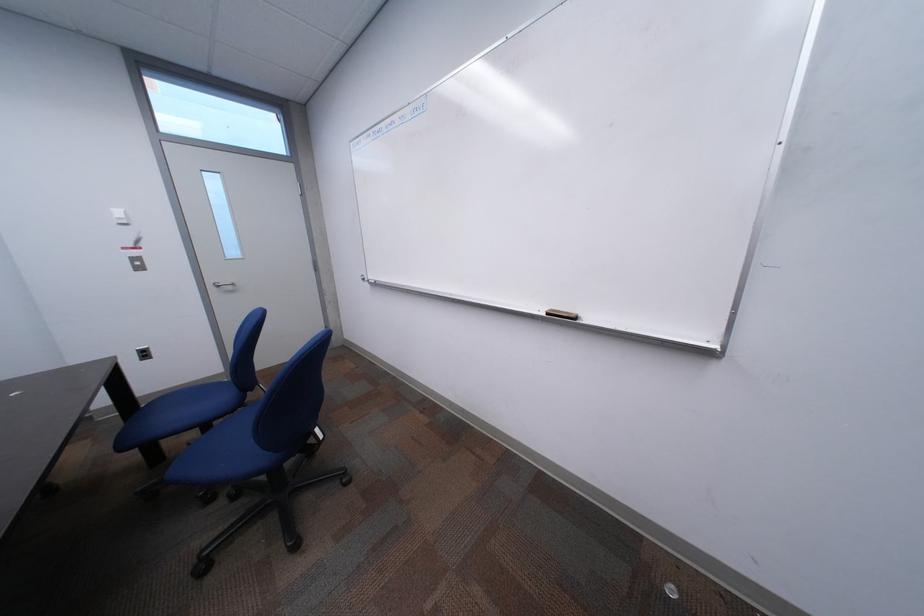
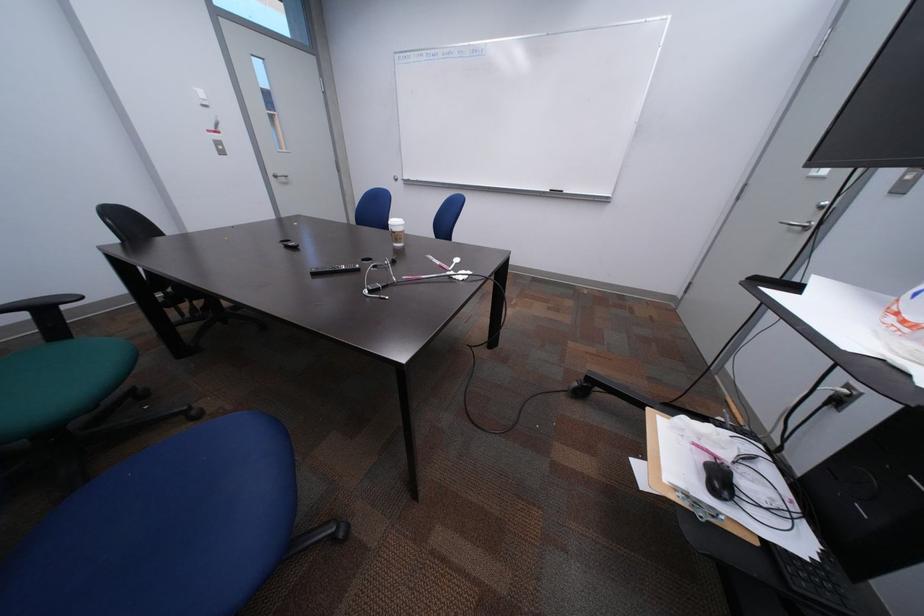
The images are taken continuously from a first-person perspective. In which direction are you moving?

The movement direction of the cameraman is left, backward.